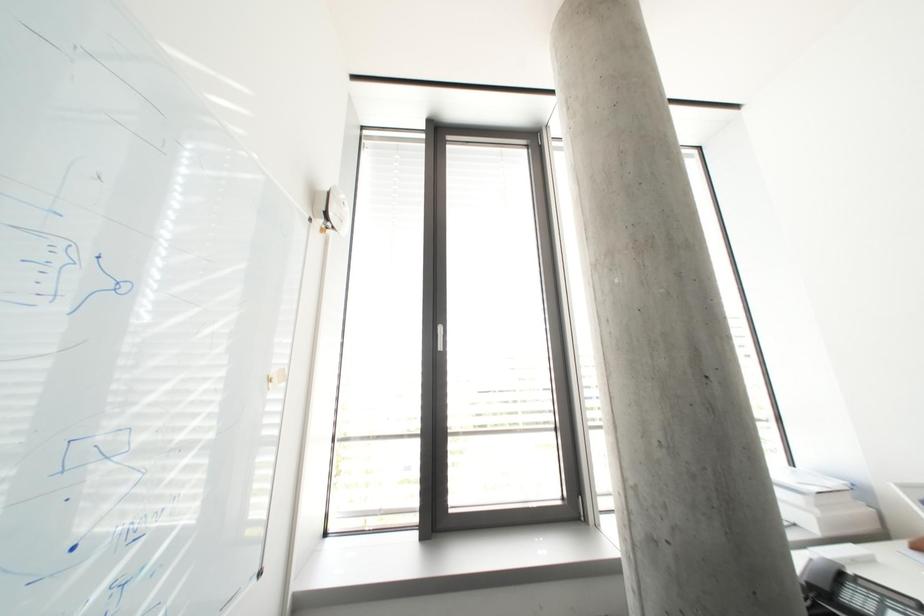
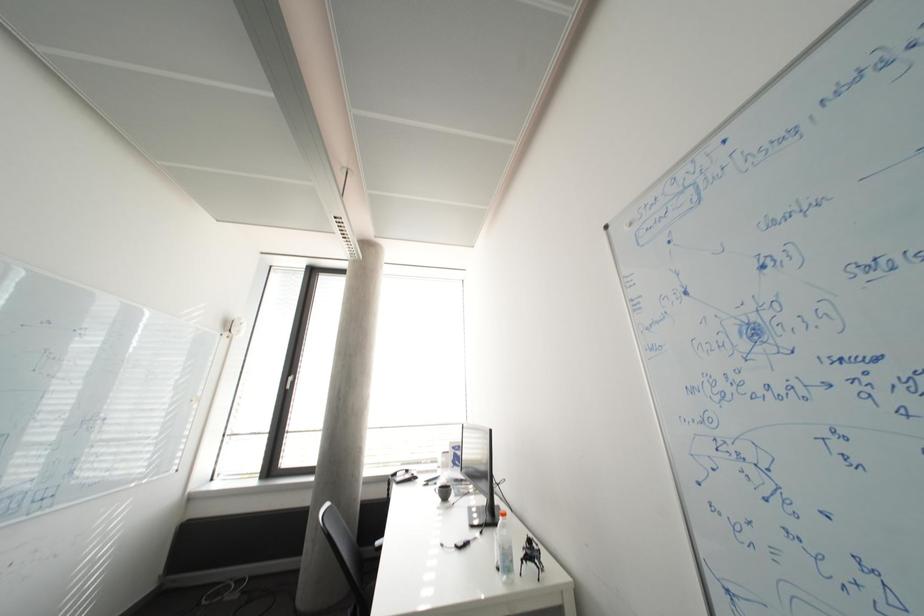
The images are taken continuously from a first-person perspective. In which direction are you moving?

The movement direction of the cameraman is right, backward.